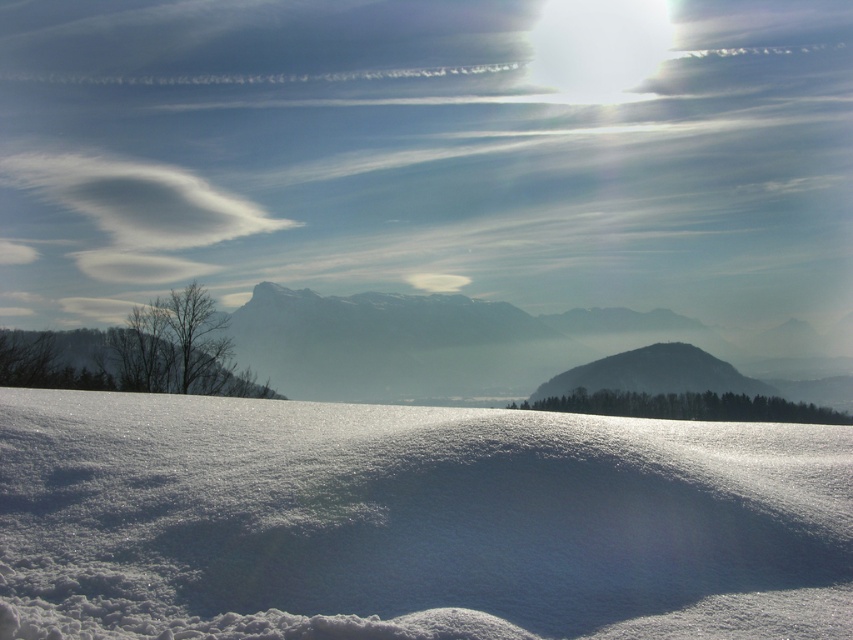
Question: Which object is farther from the camera taking this photo?

Choices:
 (A) white fluffy cloud at upper center
 (B) smooth gray rock at center
 (C) white fluffy snow at center

Answer: (A)

Question: Does white fluffy cloud at upper center lie behind smooth gray rock at center?

Choices:
 (A) yes
 (B) no

Answer: (A)

Question: Among these objects, which one is farthest from the camera?

Choices:
 (A) smooth gray rock at center
 (B) white fluffy cloud at upper center
 (C) white cotton cloud at upper left

Answer: (C)

Question: Estimate the real-world distances between objects in this image. Which object is farther from the smooth gray rock at center?

Choices:
 (A) white cotton cloud at upper left
 (B) white fluffy snow at center

Answer: (B)

Question: From the image, what is the correct spatial relationship of white fluffy snow at center in relation to smooth gray rock at center?

Choices:
 (A) below
 (B) above

Answer: (B)

Question: Can you confirm if white fluffy cloud at upper center is wider than white cotton cloud at upper left?

Choices:
 (A) yes
 (B) no

Answer: (A)